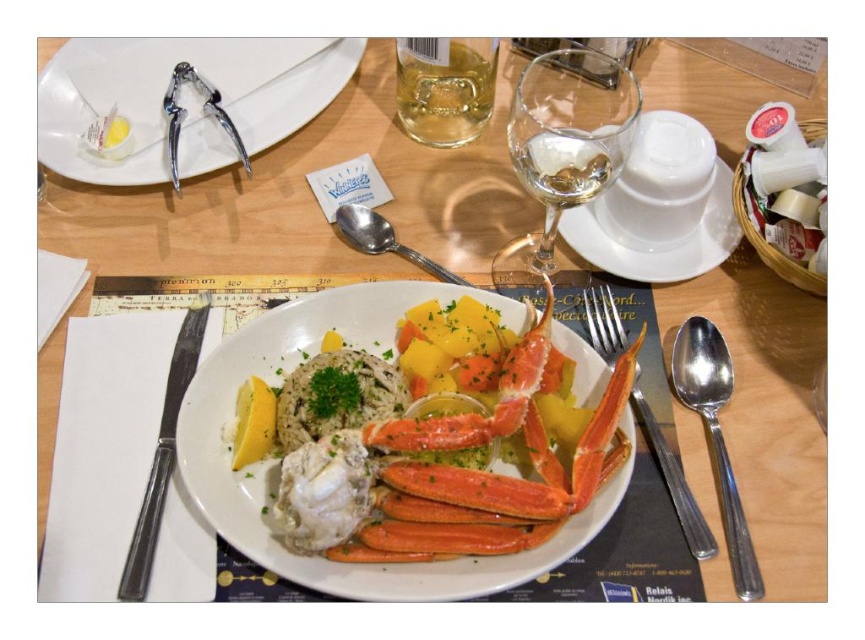
You are a server arranging a table for a seafood dinner. You have a white porcelain plate at upper center and a transparent glass wine glass at upper center. According to the setup, which item is placed above the other?

Result: The white porcelain plate at upper center is positioned over transparent glass wine glass at upper center, so the plate is above the glass.

You are a photographer setting up a shot of the dining table. The white glossy plate at center needs to be exactly 12 inches away from the camera to achieve the desired depth of field. Can you adjust the plate to meet this requirement?

The white glossy plate at center is currently 13.32 inches from the camera, so you need to move it closer by 1.32 inches to reach the required 12 inches.